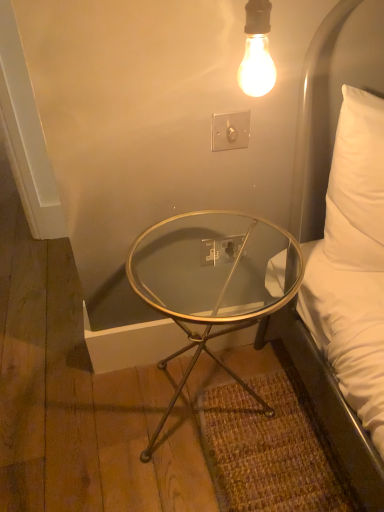
Question: Can you confirm if clear glass table at lower center is wider than white plastic switch at upper center, which is the second electric outlet from back to front?

Choices:
 (A) yes
 (B) no

Answer: (A)

Question: Considering the relative sizes of clear glass table at lower center and white plastic switch at upper center, the first electric outlet from the top, in the image provided, is clear glass table at lower center bigger than white plastic switch at upper center, the first electric outlet from the top,?

Choices:
 (A) no
 (B) yes

Answer: (B)

Question: Is clear glass table at lower center next to white plastic switch at upper center, the first electric outlet from the top?

Choices:
 (A) yes
 (B) no

Answer: (B)

Question: Can white plastic switch at upper center, which is the second electric outlet from back to front, be found inside clear glass table at lower center?

Choices:
 (A) no
 (B) yes

Answer: (A)

Question: Is clear glass table at lower center positioned with its back to white plastic switch at upper center, the first electric outlet from the top?

Choices:
 (A) no
 (B) yes

Answer: (A)

Question: Considering the positions of clear glass table at lower center and white plastic switch at upper center, the first electric outlet from the top, in the image, is clear glass table at lower center taller or shorter than white plastic switch at upper center, the first electric outlet from the top,?

Choices:
 (A) tall
 (B) short

Answer: (A)

Question: Is point (177, 274) closer or farther from the camera than point (216, 139)?

Choices:
 (A) farther
 (B) closer

Answer: (A)

Question: From a real-world perspective, is clear glass table at lower center physically located above or below white plastic switch at upper center, which is the 1th electric outlet in front-to-back order?

Choices:
 (A) below
 (B) above

Answer: (A)

Question: Is clear glass table at lower center in front of or behind white plastic switch at upper center, which is the 1th electric outlet in front-to-back order, in the image?

Choices:
 (A) front
 (B) behind

Answer: (A)

Question: Considering their positions, is white plastic outlet at center, marked as the 1th electric outlet in a back-to-front arrangement, located in front of or behind clear glass table at lower center?

Choices:
 (A) behind
 (B) front

Answer: (A)

Question: In the image, is white plastic outlet at center, positioned as the 2th electric outlet in front-to-back order, on the left side or the right side of clear glass table at lower center?

Choices:
 (A) left
 (B) right

Answer: (B)

Question: In terms of height, does white plastic outlet at center, positioned as the 2th electric outlet in front-to-back order, look taller or shorter compared to clear glass table at lower center?

Choices:
 (A) tall
 (B) short

Answer: (B)

Question: Does point (238, 239) appear closer or farther from the camera than point (198, 266)?

Choices:
 (A) farther
 (B) closer

Answer: (B)

Question: Is clear glass table at lower center wider or thinner than white plastic outlet at center, which is counted as the second electric outlet, starting from the top?

Choices:
 (A) thin
 (B) wide

Answer: (B)

Question: Considering the relative positions of clear glass table at lower center and white plastic outlet at center, which is counted as the first electric outlet, starting from the bottom, in the image provided, is clear glass table at lower center to the left or to the right of white plastic outlet at center, which is counted as the first electric outlet, starting from the bottom,?

Choices:
 (A) right
 (B) left

Answer: (B)